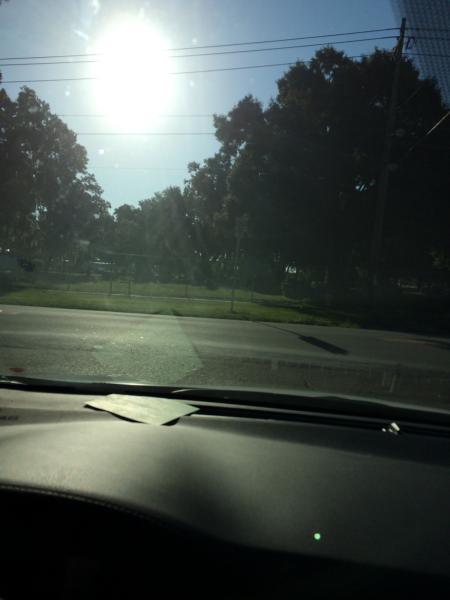
I want to click on window, so click(x=215, y=355).